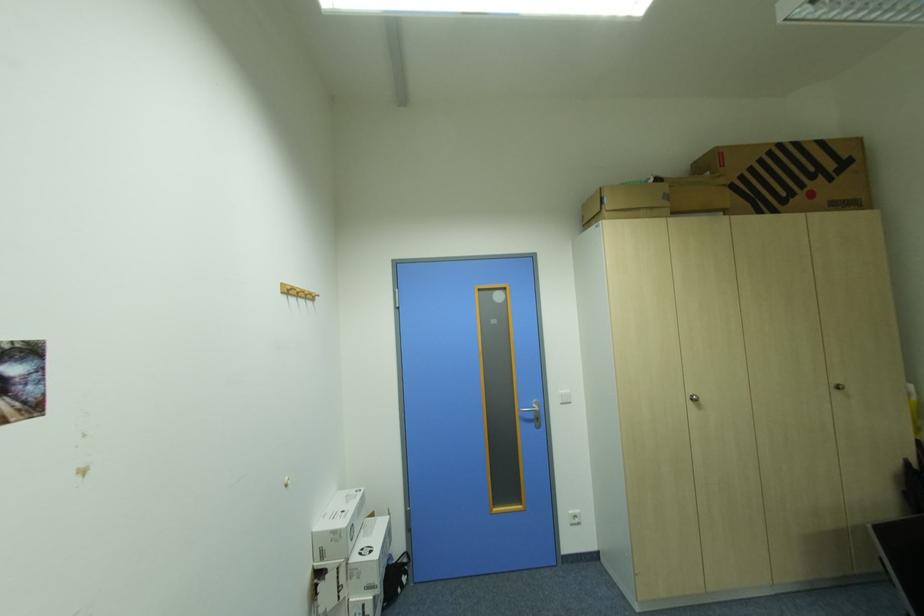
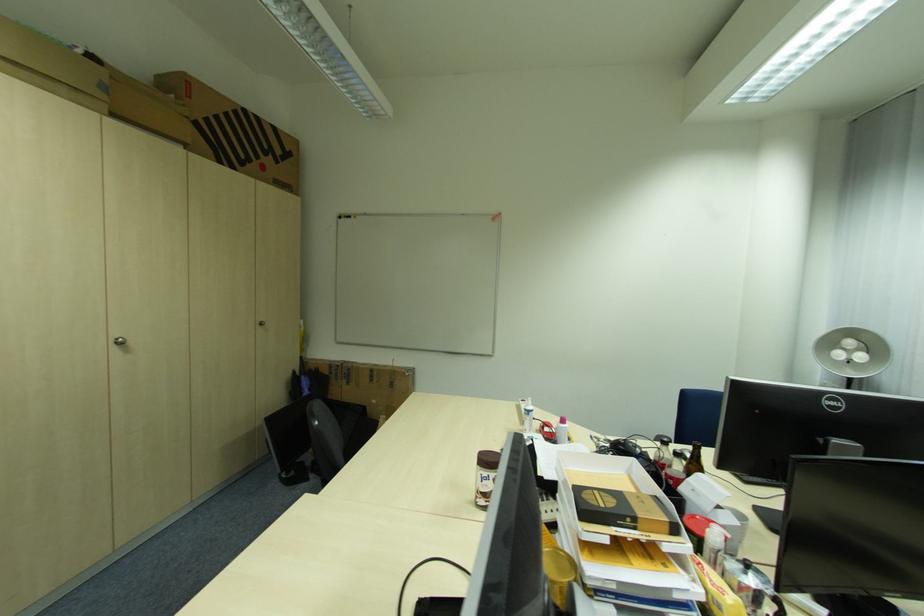
Question: The camera is either moving clockwise (left) or counter-clockwise (right) around the object. The first image is from the beginning of the video and the second image is from the end. Is the camera moving left or right when shooting the video?

Choices:
 (A) Left
 (B) Right

Answer: (A)